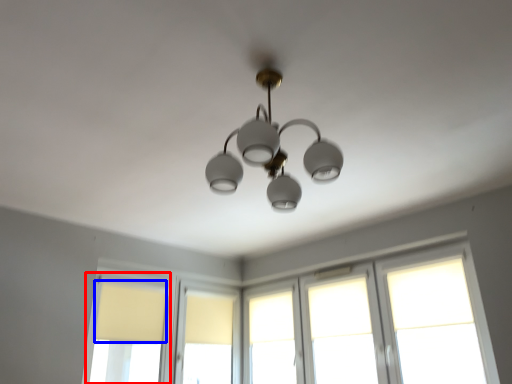
Question: Among these objects, which one is farthest to the camera, window (highlighted by a red box) or curtain (highlighted by a blue box)?

Choices:
 (A) window
 (B) curtain

Answer: (B)